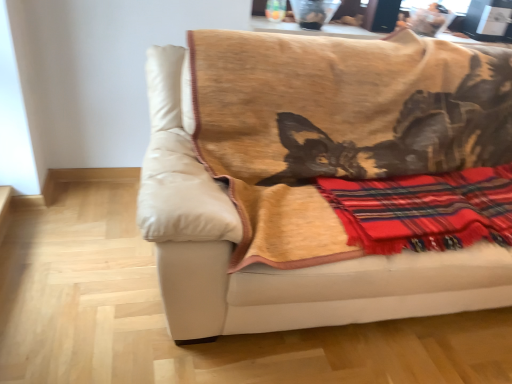
Question: Considering the relative sizes of beige leather couch at center and red plaid blanket at right in the image provided, is beige leather couch at center bigger than red plaid blanket at right?

Choices:
 (A) no
 (B) yes

Answer: (B)

Question: Does beige leather couch at center have a greater width compared to red plaid blanket at right?

Choices:
 (A) no
 (B) yes

Answer: (B)

Question: Is beige leather couch at center further to camera compared to red plaid blanket at right?

Choices:
 (A) yes
 (B) no

Answer: (B)

Question: Is beige leather couch at center not inside red plaid blanket at right?

Choices:
 (A) yes
 (B) no

Answer: (A)

Question: Can you confirm if beige leather couch at center is shorter than red plaid blanket at right?

Choices:
 (A) yes
 (B) no

Answer: (B)

Question: From a real-world perspective, is beige leather couch at center physically below red plaid blanket at right?

Choices:
 (A) no
 (B) yes

Answer: (B)

Question: Considering the relative sizes of red plaid blanket at right and beige leather couch at center in the image provided, is red plaid blanket at right bigger than beige leather couch at center?

Choices:
 (A) yes
 (B) no

Answer: (B)

Question: Is red plaid blanket at right at the left side of beige leather couch at center?

Choices:
 (A) no
 (B) yes

Answer: (A)

Question: Is beige leather couch at center a part of red plaid blanket at right?

Choices:
 (A) yes
 (B) no

Answer: (B)

Question: From the image's perspective, is red plaid blanket at right below beige leather couch at center?

Choices:
 (A) yes
 (B) no

Answer: (A)

Question: Does red plaid blanket at right have a greater height compared to beige leather couch at center?

Choices:
 (A) yes
 (B) no

Answer: (B)

Question: From a real-world perspective, is red plaid blanket at right below beige leather couch at center?

Choices:
 (A) no
 (B) yes

Answer: (A)

Question: From the image's perspective, is beige leather couch at center positioned above or below red plaid blanket at right?

Choices:
 (A) below
 (B) above

Answer: (B)